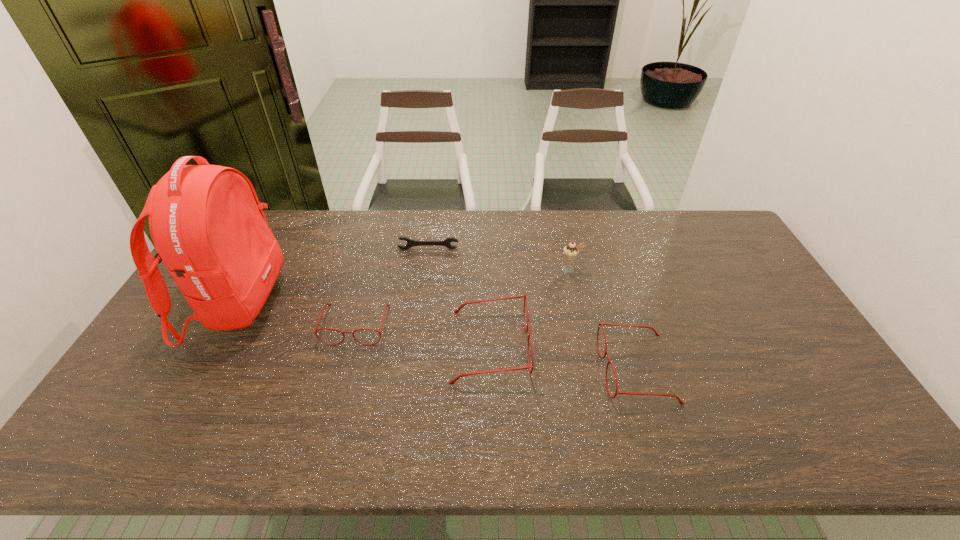
Identify the location of vacant space at the far edge of the desktop. (547, 223).

You are a GUI agent. You are given a task and a screenshot of the screen. Output one action in this format:
    pyautogui.click(x=<x>, y=<y>)
    Task: Click on the free spot at the near edge of the desktop
    Image resolution: width=960 pixels, height=540 pixels.
    Given the screenshot: What is the action you would take?
    pyautogui.click(x=382, y=386)

You are a GUI agent. You are given a task and a screenshot of the screen. Output one action in this format:
    pyautogui.click(x=<x>, y=<y>)
    Task: Click on the free spot at the left edge of the desktop
    The height and width of the screenshot is (540, 960).
    Given the screenshot: What is the action you would take?
    pyautogui.click(x=178, y=353)

Identify the location of vacant space at the right edge. The height and width of the screenshot is (540, 960). (776, 298).

Find the location of a particular element. free location at the far right corner of the desktop is located at coordinates (694, 228).

The height and width of the screenshot is (540, 960). What are the coordinates of `vacant region at the near right corner of the desktop` in the screenshot? It's located at (804, 390).

Locate an element on the screen. The width and height of the screenshot is (960, 540). free space between the shortest object and the rightmost spectacles is located at coordinates (532, 309).

Find the location of a particular element. The image size is (960, 540). vacant region between the second shortest spectacles and the fifth tallest object is located at coordinates (496, 347).

The image size is (960, 540). Find the location of `vacant space in between the leftmost object and the shortest spectacles`. vacant space in between the leftmost object and the shortest spectacles is located at coordinates (298, 314).

This screenshot has width=960, height=540. I want to click on free space between the second shortest spectacles and the farthest object, so click(x=532, y=309).